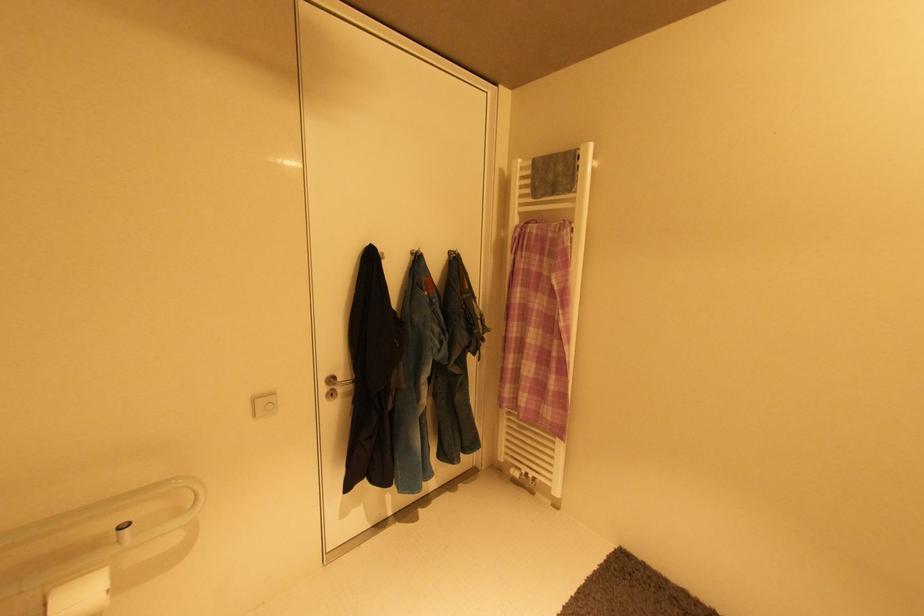
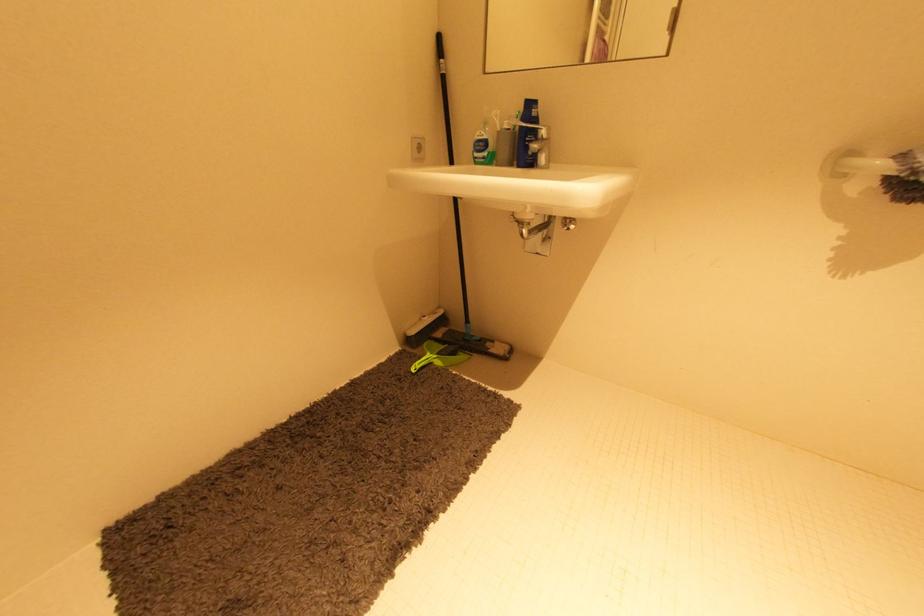
The images are taken continuously from a first-person perspective. In which direction is your viewpoint rotating?

The camera rotated toward right-down.